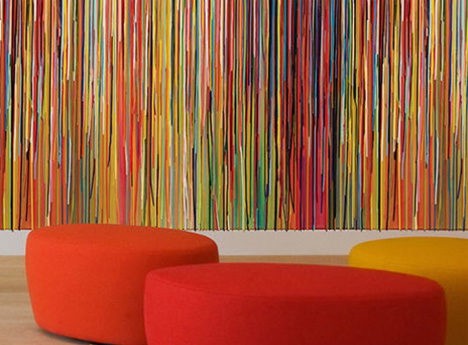
Image resolution: width=468 pixels, height=345 pixels. Identify the location of top of red ottoman. (297, 275).